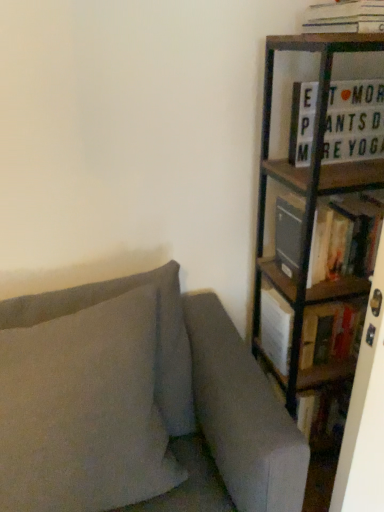
Question: Considering the relative sizes of hardcover book at right, which is the 1th book from bottom to top, and white paper stack at upper right, which ranks as the first book in top-to-bottom order, in the image provided, is hardcover book at right, which is the 1th book from bottom to top, taller than white paper stack at upper right, which ranks as the first book in top-to-bottom order,?

Choices:
 (A) no
 (B) yes

Answer: (B)

Question: Is white paper stack at upper right, which ranks as the first book in top-to-bottom order, at the back of hardcover book at right, which is the 1th book from bottom to top?

Choices:
 (A) yes
 (B) no

Answer: (B)

Question: Considering the relative sizes of hardcover book at right, the 3th book positioned from the top, and white paper stack at upper right, which ranks as the first book in top-to-bottom order, in the image provided, is hardcover book at right, the 3th book positioned from the top, shorter than white paper stack at upper right, which ranks as the first book in top-to-bottom order,?

Choices:
 (A) no
 (B) yes

Answer: (A)

Question: Are hardcover book at right, the 3th book positioned from the top, and white paper stack at upper right, which ranks as the first book in top-to-bottom order, far apart?

Choices:
 (A) no
 (B) yes

Answer: (A)

Question: Considering the relative sizes of hardcover book at right, the 3th book positioned from the top, and white paper stack at upper right, which ranks as the third book in bottom-to-top order, in the image provided, is hardcover book at right, the 3th book positioned from the top, bigger than white paper stack at upper right, which ranks as the third book in bottom-to-top order,?

Choices:
 (A) yes
 (B) no

Answer: (A)

Question: Can white paper stack at upper right, which ranks as the third book in bottom-to-top order, be found inside hardcover book at right, the 3th book positioned from the top?

Choices:
 (A) yes
 (B) no

Answer: (B)

Question: Considering the relative positions of hardcover book at right, the 3th book positioned from the top, and wooden bookcase at right in the image provided, is hardcover book at right, the 3th book positioned from the top, to the right of wooden bookcase at right from the viewer's perspective?

Choices:
 (A) no
 (B) yes

Answer: (A)

Question: Is hardcover book at right, which is the 1th book from bottom to top, positioned far away from wooden bookcase at right?

Choices:
 (A) no
 (B) yes

Answer: (A)

Question: Are hardcover book at right, which is the 1th book from bottom to top, and wooden bookcase at right beside each other?

Choices:
 (A) no
 (B) yes

Answer: (A)

Question: Can you confirm if hardcover book at right, the 3th book positioned from the top, is taller than wooden bookcase at right?

Choices:
 (A) no
 (B) yes

Answer: (A)

Question: Is hardcover book at right, the 3th book positioned from the top, positioned with its back to wooden bookcase at right?

Choices:
 (A) no
 (B) yes

Answer: (B)

Question: Could you tell me if hardcover book at right, the 3th book positioned from the top, is turned towards wooden bookcase at right?

Choices:
 (A) no
 (B) yes

Answer: (B)

Question: Is suede-like gray pillow at left outside wooden bookcase at right?

Choices:
 (A) no
 (B) yes

Answer: (B)